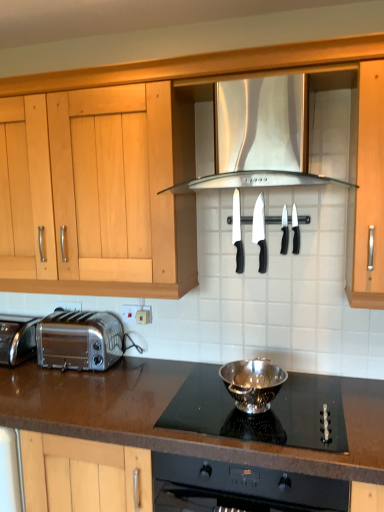
Question: Is silver metallic bowl at center, the 1th kitchen appliance in the front-to-back sequence, bigger than black plastic knife at center, the 5th kitchen appliance from the front?

Choices:
 (A) yes
 (B) no

Answer: (A)

Question: Is black plastic knife at center, the 5th kitchen appliance from the front, surrounded by silver metallic bowl at center, the 1th kitchen appliance in the front-to-back sequence?

Choices:
 (A) yes
 (B) no

Answer: (B)

Question: Is silver metallic bowl at center, the 5th kitchen appliance from the back, smaller than black plastic knife at center, the 5th kitchen appliance from the front?

Choices:
 (A) no
 (B) yes

Answer: (A)

Question: Is silver metallic bowl at center, the 5th kitchen appliance from the back, turned away from black plastic knife at center, the 5th kitchen appliance from the front?

Choices:
 (A) yes
 (B) no

Answer: (B)

Question: Could you tell me if silver metallic bowl at center, the 1th kitchen appliance in the front-to-back sequence, is turned towards black plastic knife at center, positioned as the 1th kitchen appliance in back-to-front order?

Choices:
 (A) yes
 (B) no

Answer: (B)

Question: From a real-world perspective, is polished chrome toaster at lower left positioned above or below stainless steel exhaust hood at center?

Choices:
 (A) below
 (B) above

Answer: (A)

Question: In the image, is polished chrome toaster at lower left positioned in front of or behind stainless steel exhaust hood at center?

Choices:
 (A) behind
 (B) front

Answer: (A)

Question: Considering the positions of polished chrome toaster at lower left and stainless steel exhaust hood at center in the image, is polished chrome toaster at lower left bigger or smaller than stainless steel exhaust hood at center?

Choices:
 (A) big
 (B) small

Answer: (B)

Question: Considering the positions of polished chrome toaster at lower left and stainless steel exhaust hood at center in the image, is polished chrome toaster at lower left wider or thinner than stainless steel exhaust hood at center?

Choices:
 (A) wide
 (B) thin

Answer: (B)

Question: In terms of width, does black plastic knife at upper center, the 2th kitchen appliance in the front-to-back sequence, look wider or thinner when compared to brown granite countertop at lower center?

Choices:
 (A) thin
 (B) wide

Answer: (A)

Question: From a real-world perspective, relative to brown granite countertop at lower center, is black plastic knife at upper center, arranged as the fourth kitchen appliance when viewed from the back, vertically above or below?

Choices:
 (A) above
 (B) below

Answer: (A)

Question: Is black plastic knife at upper center, the 2th kitchen appliance in the front-to-back sequence, taller or shorter than brown granite countertop at lower center?

Choices:
 (A) tall
 (B) short

Answer: (B)

Question: Is black plastic knife at upper center, arranged as the fourth kitchen appliance when viewed from the back, bigger or smaller than brown granite countertop at lower center?

Choices:
 (A) big
 (B) small

Answer: (B)

Question: From the image's perspective, is stainless steel exhaust hood at center positioned above or below black plastic knife at upper center, the 2th kitchen appliance in the front-to-back sequence?

Choices:
 (A) below
 (B) above

Answer: (B)

Question: Considering the positions of stainless steel exhaust hood at center and black plastic knife at upper center, arranged as the fourth kitchen appliance when viewed from the back, in the image, is stainless steel exhaust hood at center taller or shorter than black plastic knife at upper center, arranged as the fourth kitchen appliance when viewed from the back,?

Choices:
 (A) tall
 (B) short

Answer: (A)